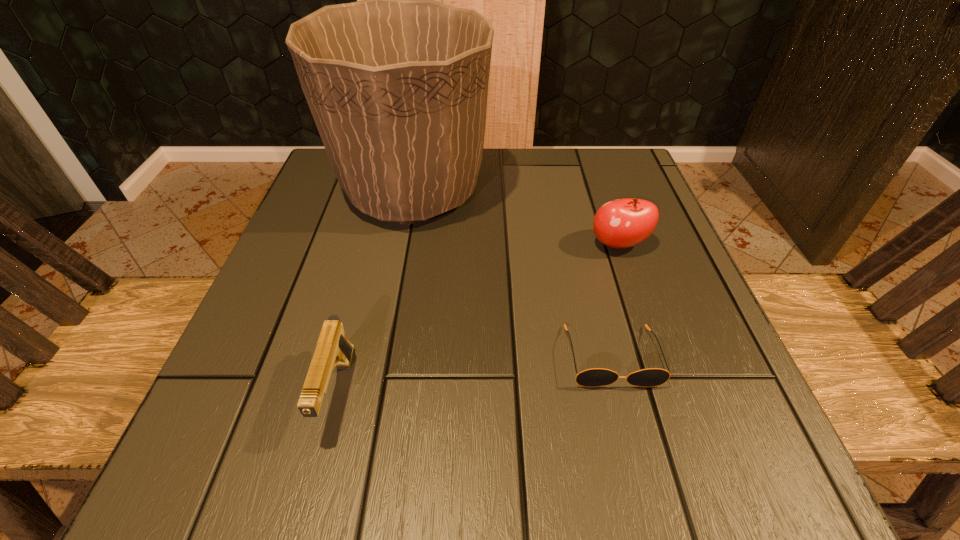
Find the location of a particular element. pistol located at the left edge is located at coordinates (333, 349).

Identify the location of apple present at the right edge. (622, 223).

At what (x,y) coordinates should I click in order to perform the action: click on sunglasses present at the right edge. Please return your answer as a coordinate pair (x, y). The width and height of the screenshot is (960, 540). Looking at the image, I should click on (595, 377).

Locate an element on the screen. Image resolution: width=960 pixels, height=540 pixels. object present at the far left corner is located at coordinates (397, 84).

Locate an element on the screen. The width and height of the screenshot is (960, 540). object that is at the near left corner is located at coordinates click(333, 349).

In the image, there is a desktop. Where is `free space at the far edge`? This screenshot has height=540, width=960. free space at the far edge is located at coordinates (549, 206).

The width and height of the screenshot is (960, 540). What are the coordinates of `free region at the near edge of the desktop` in the screenshot? It's located at (503, 428).

This screenshot has width=960, height=540. In order to click on vacant space at the left edge of the desktop in this screenshot , I will do `click(245, 380)`.

In the image, there is a desktop. Where is `vacant area at the right edge`? The width and height of the screenshot is (960, 540). vacant area at the right edge is located at coordinates [x=703, y=320].

The width and height of the screenshot is (960, 540). What are the coordinates of `vacant space at the near left corner of the desktop` in the screenshot? It's located at (302, 452).